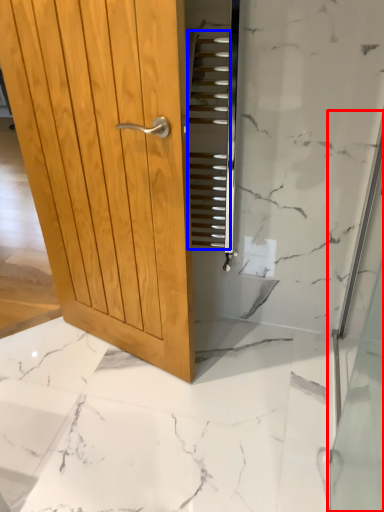
Question: Which point is closer to the camera, shower door (highlighted by a red box) or stair (highlighted by a blue box)?

Choices:
 (A) shower door
 (B) stair

Answer: (A)